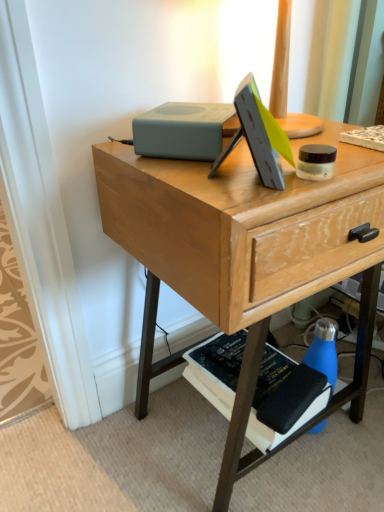
At what (x,y) coordinates should I click in order to perform the action: click on hardcover black book at lower right. Please return your answer as a coordinate pair (x, y). Image resolution: width=384 pixels, height=512 pixels. Looking at the image, I should click on (284, 399).

Image resolution: width=384 pixels, height=512 pixels. Describe the element at coordinates (284, 399) in the screenshot. I see `hardcover black book at lower right` at that location.

Where is `hardcover black book at lower right`? hardcover black book at lower right is located at coordinates (284, 399).

Consider the image. Does hardcover black book at lower right lie behind blue matte water bottle at lower right?

No, the depth of hardcover black book at lower right is less than that of blue matte water bottle at lower right.

Is blue matte water bottle at lower right completely or partially inside hardcover black book at lower right?

No.

Between point (218, 346) and point (307, 353), which one is positioned behind?

The point (218, 346) is behind.

Are hardcover black book at lower right and blue matte water bottle at lower right beside each other?

No, hardcover black book at lower right is not with blue matte water bottle at lower right.

Can you confirm if wooden desk at center is wider than hardcover black book at lower right?

Yes.

Is wooden desk at center surrounding hardcover black book at lower right?

That's correct, hardcover black book at lower right is inside wooden desk at center.

From a real-world perspective, does wooden desk at center sit lower than hardcover black book at lower right?

No, from a real-world perspective, wooden desk at center is not beneath hardcover black book at lower right.

Can you confirm if blue matte water bottle at lower right is smaller than hardcover black book at lower right?

Indeed, blue matte water bottle at lower right has a smaller size compared to hardcover black book at lower right.

In the scene shown: Considering the sizes of objects blue matte water bottle at lower right and hardcover black book at lower right in the image provided, who is thinner, blue matte water bottle at lower right or hardcover black book at lower right?

With smaller width is blue matte water bottle at lower right.

From the picture: Is blue matte water bottle at lower right taller or shorter than hardcover black book at lower right?

Clearly, blue matte water bottle at lower right is taller compared to hardcover black book at lower right.

How distant is blue matte water bottle at lower right from hardcover black book at lower right?

blue matte water bottle at lower right and hardcover black book at lower right are 4.55 inches apart.

Considering the relative sizes of blue matte water bottle at lower right and wooden desk at center in the image provided, is blue matte water bottle at lower right smaller than wooden desk at center?

Yes.

From the image's perspective, between blue matte water bottle at lower right and wooden desk at center, which one is located above?

From the image's view, wooden desk at center is above.

The height and width of the screenshot is (512, 384). I want to click on desk above the blue matte water bottle at lower right (from the image's perspective), so click(x=245, y=256).

Based on their positions, is blue matte water bottle at lower right located to the left or right of wooden desk at center?

Clearly, blue matte water bottle at lower right is on the right of wooden desk at center in the image.

Between wooden desk at center and blue matte water bottle at lower right, which one has larger size?

Bigger between the two is wooden desk at center.

Is wooden desk at center positioned before blue matte water bottle at lower right?

Yes.

Visually, is wooden desk at center positioned to the left or to the right of blue matte water bottle at lower right?

wooden desk at center is to the left of blue matte water bottle at lower right.

From a real-world perspective, is wooden desk at center physically above blue matte water bottle at lower right?

Correct, in the physical world, wooden desk at center is higher than blue matte water bottle at lower right.

Is hardcover black book at lower right bigger than wooden desk at center?

Actually, hardcover black book at lower right might be smaller than wooden desk at center.

Is hardcover black book at lower right positioned with its back to wooden desk at center?

Yes, wooden desk at center is at the back of hardcover black book at lower right.

Would you consider hardcover black book at lower right to be distant from wooden desk at center?

hardcover black book at lower right is near wooden desk at center, not far away.

Where is `bottle on the right of hardcover black book at lower right`? This screenshot has width=384, height=512. bottle on the right of hardcover black book at lower right is located at coordinates (324, 350).

Find the location of `paperback book behind the wooden desk at center`. paperback book behind the wooden desk at center is located at coordinates (284, 399).

Which object lies further to the anchor point blue matte water bottle at lower right, hardcover black book at lower right or wooden desk at center?

Based on the image, wooden desk at center appears to be further to blue matte water bottle at lower right.

Looking at the image, which one is located further to hardcover black book at lower right, blue matte water bottle at lower right or wooden desk at center?

wooden desk at center is further to hardcover black book at lower right.

Looking at the image, which one is located closer to hardcover black book at lower right, wooden desk at center or blue matte water bottle at lower right?

The object closer to hardcover black book at lower right is blue matte water bottle at lower right.

When comparing their distances from wooden desk at center, does blue matte water bottle at lower right or hardcover black book at lower right seem closer?

hardcover black book at lower right lies closer to wooden desk at center than the other object.

Based on their spatial positions, is hardcover black book at lower right or blue matte water bottle at lower right closer to wooden desk at center?

hardcover black book at lower right is closer to wooden desk at center.

Considering their positions, is wooden desk at center positioned closer to blue matte water bottle at lower right than hardcover black book at lower right?

Among the two, hardcover black book at lower right is located nearer to blue matte water bottle at lower right.

Where is `paperback book between wooden desk at center and blue matte water bottle at lower right from front to back`? The height and width of the screenshot is (512, 384). paperback book between wooden desk at center and blue matte water bottle at lower right from front to back is located at coordinates (284, 399).